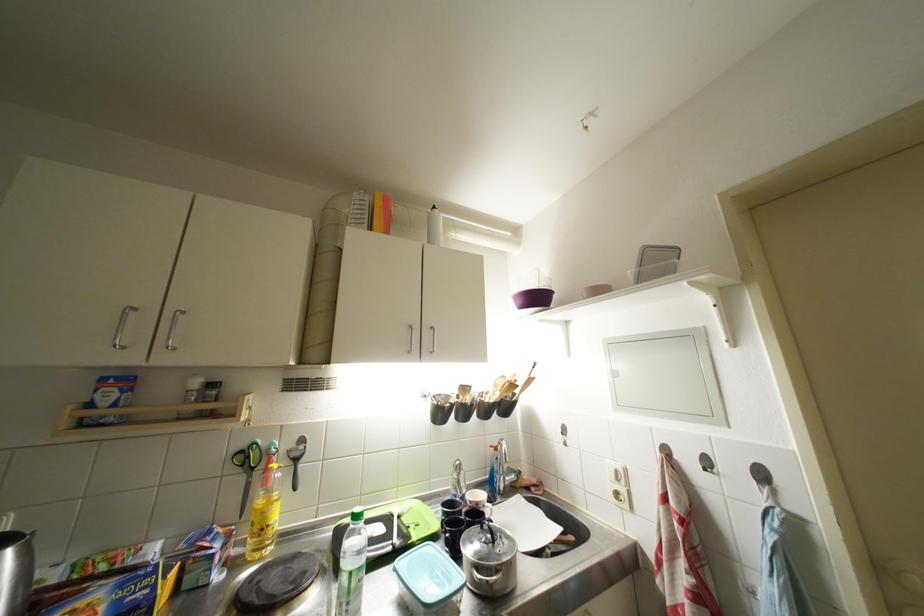
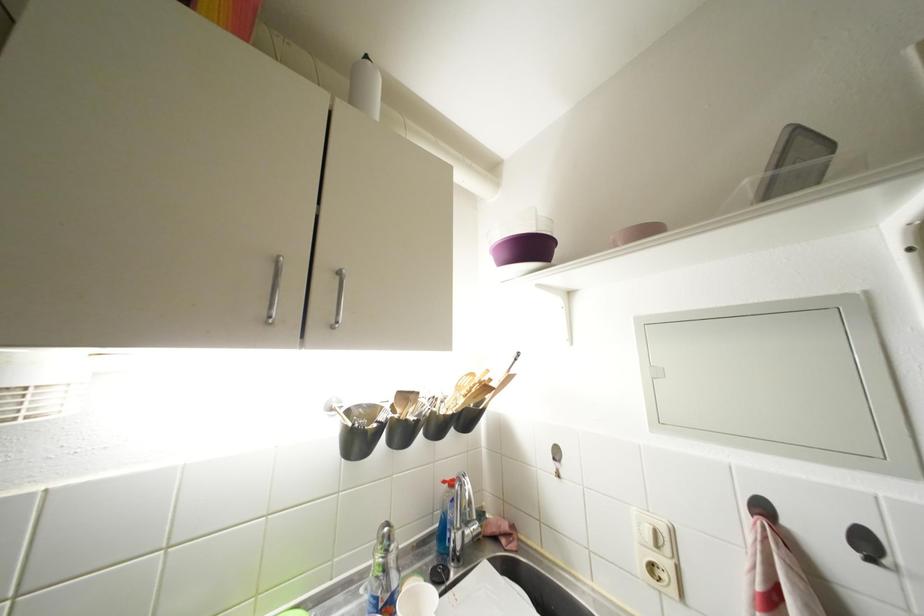
Find the pixel in the second image that matches (568,442) in the first image.

(560, 469)